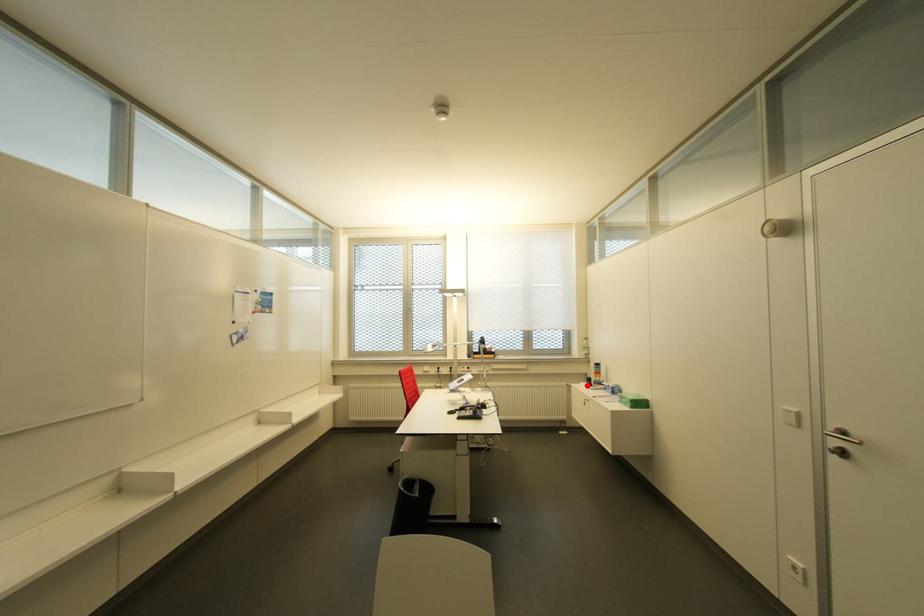
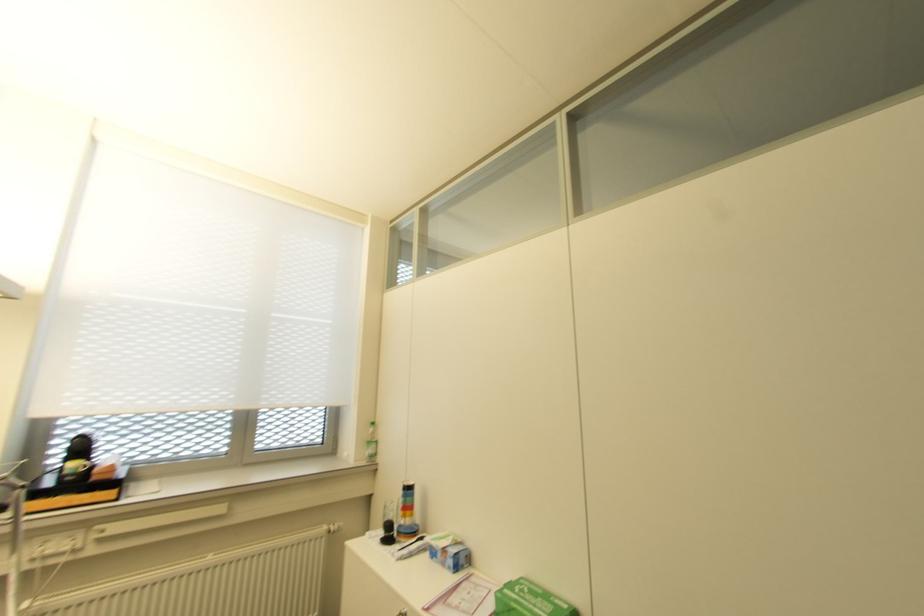
Find the pixel in the second image that matches the highlighted location in the first image.

(385, 540)